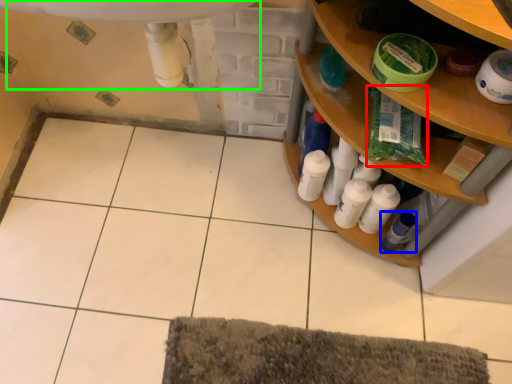
Question: Which object is the farthest from material (highlighted by a red box)? Choose among these: toiletry (highlighted by a blue box) or sink (highlighted by a green box).

Choices:
 (A) toiletry
 (B) sink

Answer: (B)